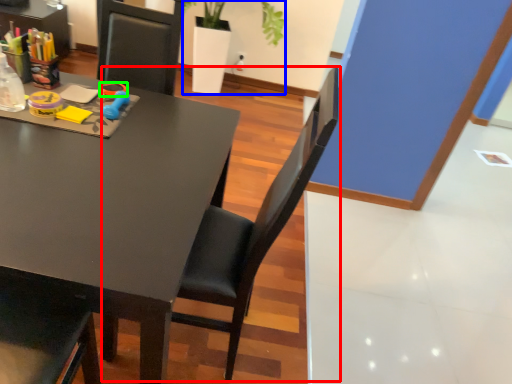
Question: Based on their relative distances, which object is nearer to chair (highlighted by a red box)? Choose from houseplant (highlighted by a blue box) and scissors (highlighted by a green box).

Choices:
 (A) houseplant
 (B) scissors

Answer: (B)